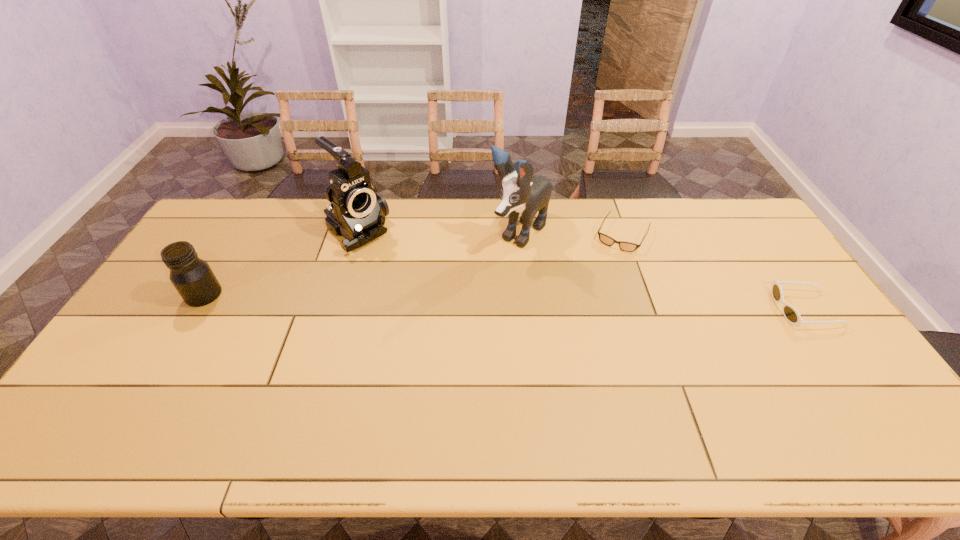
Find the location of a particular element. free spot on the desktop that is between the third tallest object and the nearer sunglasses and is positioned on the front-facing side of the tallest object is located at coordinates (450, 301).

I want to click on free space on the desktop that is between the leftmost object and the taller sunglasses and is positioned on the lens mount of the fourth shortest object, so click(x=441, y=300).

What are the coordinates of `vacant space on the desktop that is between the jar and the second shortest object and is positioned on the front-facing side of the shorter sunglasses` in the screenshot? It's located at (588, 304).